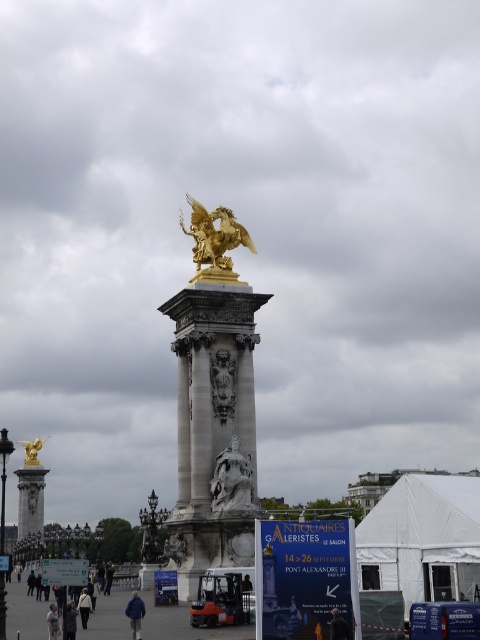
Between polished stone statue at center and gold metallic statue at left, which one has more height?

gold metallic statue at left is taller.

Does polished stone statue at center have a greater width compared to gold metallic statue at left?

No.

Where is `polished stone statue at center`? polished stone statue at center is located at coordinates (231, 481).

Identify the location of polished stone statue at center. The image size is (480, 640). (231, 481).

Which is behind, point (108, 572) or point (34, 580)?

The point (34, 580) is more distant.

Which is more to the right, dark blue jacket at center or dark blue jeans at lower left?

Positioned to the right is dark blue jacket at center.

The image size is (480, 640). Describe the element at coordinates (108, 577) in the screenshot. I see `dark blue jacket at center` at that location.

Identify the location of dark blue jacket at center. (108, 577).

Does gold metallic statue at left have a lesser height compared to dark blue jacket at lower center?

No.

Between point (24, 444) and point (38, 600), which one is positioned behind?

The point (24, 444) is more distant.

I want to click on gold metallic statue at left, so click(x=32, y=451).

This screenshot has height=640, width=480. In order to click on gold metallic statue at left in this screenshot , I will do `click(32, 451)`.